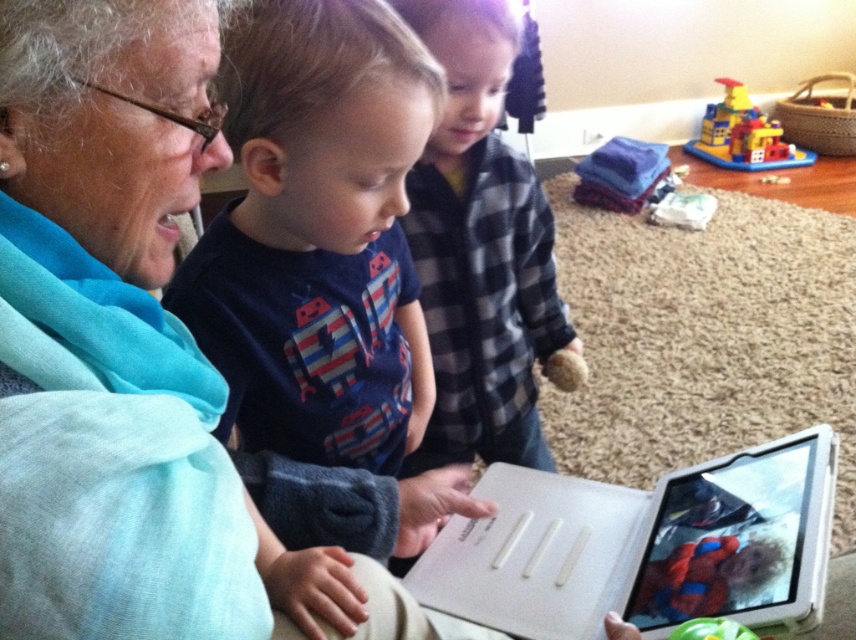
Question: Can you confirm if plaid flannel shirt at center is wider than brick-like plastic toy at upper right?

Choices:
 (A) yes
 (B) no

Answer: (B)

Question: Estimate the real-world distances between objects in this image. Which object is closer to the matte blue scarf at upper left?

Choices:
 (A) matte blue shirt at center
 (B) white plastic tablet at center
 (C) plaid flannel shirt at center
 (D) brick-like plastic toy at upper right

Answer: (A)

Question: Among these points, which one is nearest to the camera?

Choices:
 (A) (510, 221)
 (B) (720, 131)

Answer: (A)

Question: Does matte blue scarf at upper left have a larger size compared to green fabric toy at lower right?

Choices:
 (A) yes
 (B) no

Answer: (A)

Question: Can you confirm if white plastic tablet at center is positioned to the left of brick-like plastic toy at upper right?

Choices:
 (A) yes
 (B) no

Answer: (A)

Question: Among these points, which one is farthest from the camera?

Choices:
 (A) (758, 490)
 (B) (752, 120)
 (C) (312, 138)
 (D) (81, 541)

Answer: (B)